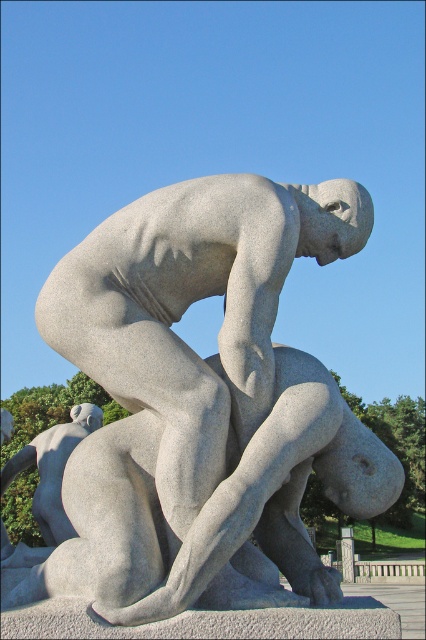
Is gray stone sculpture at center thinner than gray stone figure at lower left?

Yes.

Is gray stone sculpture at center bigger than gray stone figure at lower left?

Actually, gray stone sculpture at center might be smaller than gray stone figure at lower left.

Is point (201, 538) positioned behind point (39, 476)?

No, it is in front of (39, 476).

Where is `gray stone sculpture at center`? The width and height of the screenshot is (426, 640). gray stone sculpture at center is located at coordinates (201, 406).